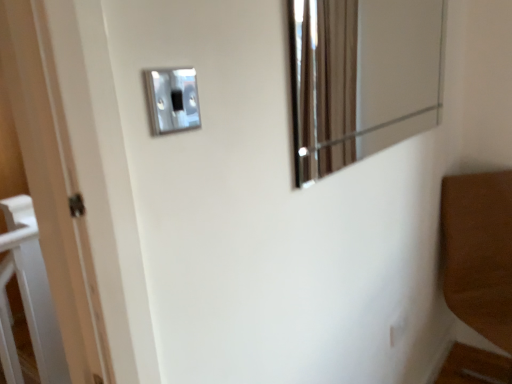
Question: Is satin silver switch at upper center, the second light switch viewed from the top, behind metallic reflective mirror at upper right?

Choices:
 (A) no
 (B) yes

Answer: (B)

Question: Is satin silver switch at upper center, which is the first light switch from back to front, in contact with metallic reflective mirror at upper right?

Choices:
 (A) yes
 (B) no

Answer: (B)

Question: From a real-world perspective, is satin silver switch at upper center, the 1th light switch from the right, on top of metallic reflective mirror at upper right?

Choices:
 (A) yes
 (B) no

Answer: (B)

Question: Would you say satin silver switch at upper center, the 2th light switch when ordered from left to right, is outside metallic reflective mirror at upper right?

Choices:
 (A) yes
 (B) no

Answer: (A)

Question: From a real-world perspective, is satin silver switch at upper center, which is the 2th light switch from front to back, located beneath metallic reflective mirror at upper right?

Choices:
 (A) no
 (B) yes

Answer: (B)

Question: Are satin silver switch at upper center, the 1th light switch from the right, and metallic reflective mirror at upper right far apart?

Choices:
 (A) no
 (B) yes

Answer: (B)

Question: Could satin silver switch at upper center, which is the second light switch in right-to-left order, be considered to be inside satin silver switch at upper center, which is the first light switch from back to front?

Choices:
 (A) no
 (B) yes

Answer: (A)

Question: Is satin silver switch at upper center, which is the first light switch from back to front, far from satin silver switch at upper center, the 2th light switch positioned from the back?

Choices:
 (A) no
 (B) yes

Answer: (B)

Question: Can you confirm if satin silver switch at upper center, the 2th light switch when ordered from left to right, is thinner than satin silver switch at upper center, marked as the 2th light switch in a bottom-to-top arrangement?

Choices:
 (A) yes
 (B) no

Answer: (A)

Question: Can you confirm if satin silver switch at upper center, the second light switch viewed from the top, is smaller than satin silver switch at upper center, the 1th light switch in the top-to-bottom sequence?

Choices:
 (A) no
 (B) yes

Answer: (A)

Question: Is satin silver switch at upper center, the 2th light switch when ordered from left to right, outside satin silver switch at upper center, which is the second light switch in right-to-left order?

Choices:
 (A) no
 (B) yes

Answer: (B)

Question: Considering the relative positions of satin silver switch at upper center, the 1th light switch from the right, and satin silver switch at upper center, which is the second light switch in right-to-left order, in the image provided, is satin silver switch at upper center, the 1th light switch from the right, to the left of satin silver switch at upper center, which is the second light switch in right-to-left order, from the viewer's perspective?

Choices:
 (A) no
 (B) yes

Answer: (A)

Question: Is the depth of metallic reflective mirror at upper right less than that of satin silver switch at upper center, the 2th light switch when ordered from left to right?

Choices:
 (A) yes
 (B) no

Answer: (A)